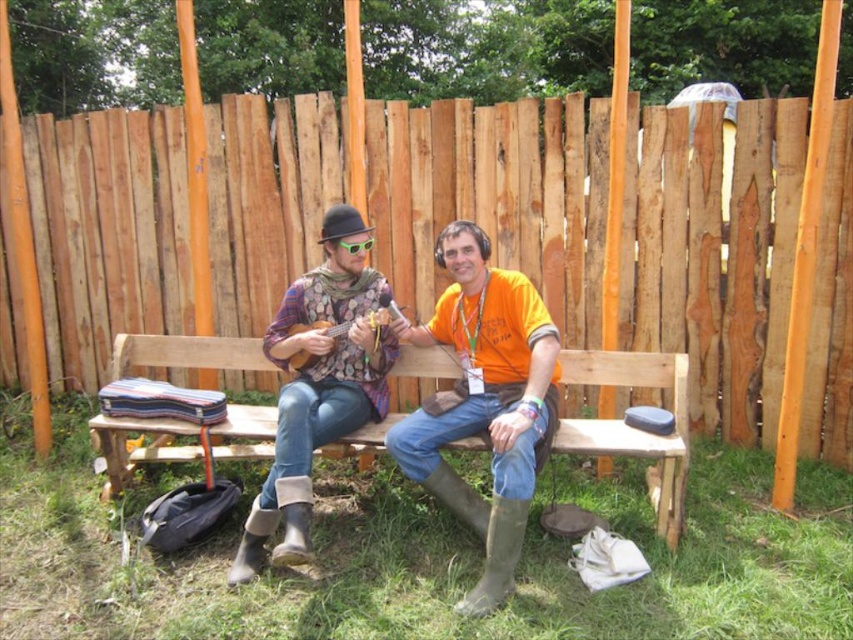
You are standing at the camera position and want to place a 3.5 meter long ladder on the ground between you and the wooden bench at center. Will the ladder fit without overlapping the bench?

The distance between the camera and the wooden bench at center is 3.21 meters, but the ladder is 3.5 meters long. Since the ladder is longer than the available space, it will not fit without overlapping the bench.